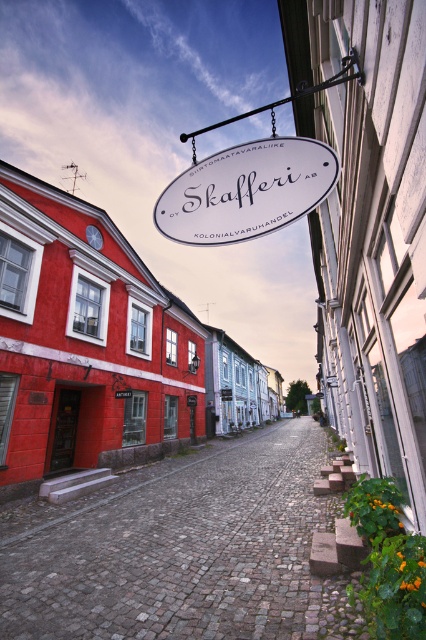
Question: Is cobblestone alley at center smaller than white oval sign at center?

Choices:
 (A) yes
 (B) no

Answer: (B)

Question: Among these objects, which one is nearest to the camera?

Choices:
 (A) white oval sign at center
 (B) cobblestone alley at center
 (C) white oval sign at upper center

Answer: (B)

Question: Does cobblestone alley at center have a larger size compared to white oval sign at upper center?

Choices:
 (A) yes
 (B) no

Answer: (B)

Question: Considering the real-world distances, which object is closest to the white oval sign at upper center?

Choices:
 (A) white oval sign at center
 (B) cobblestone alley at center

Answer: (B)

Question: Which object is farther from the camera taking this photo?

Choices:
 (A) white oval sign at upper center
 (B) white oval sign at center

Answer: (A)

Question: Observing the image, what is the correct spatial positioning of cobblestone alley at center in reference to white oval sign at upper center?

Choices:
 (A) left
 (B) right

Answer: (A)